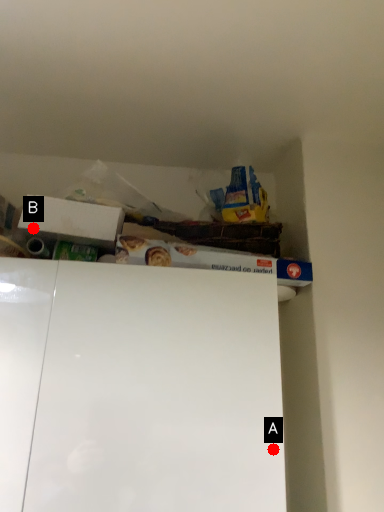
Question: Two points are circled on the image, labeled by A and B beside each circle. Among these points, which one is farthest from the camera?

Choices:
 (A) A is further
 (B) B is further

Answer: (B)